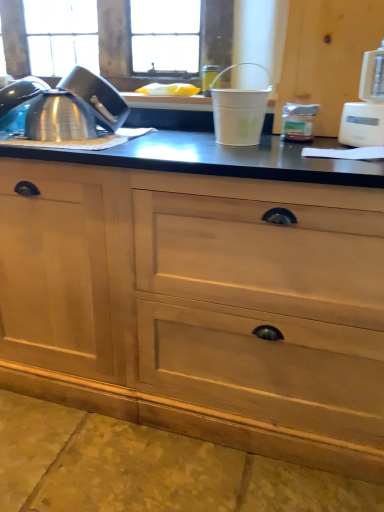
Question: Is white plastic blender at right, placed as the 2th appliance when sorted from left to right, positioned with its back to satin metallic teapot at left?

Choices:
 (A) no
 (B) yes

Answer: (A)

Question: Does white plastic blender at right, the 1th appliance from the right, have a greater height compared to satin metallic teapot at left?

Choices:
 (A) yes
 (B) no

Answer: (A)

Question: From the image's perspective, is white plastic blender at right, placed as the 2th appliance when sorted from left to right, below satin metallic teapot at left?

Choices:
 (A) no
 (B) yes

Answer: (A)

Question: From a real-world perspective, is white plastic blender at right, placed as the 2th appliance when sorted from left to right, on satin metallic teapot at left?

Choices:
 (A) no
 (B) yes

Answer: (B)

Question: From a real-world perspective, is white plastic blender at right, placed as the 2th appliance when sorted from left to right, under satin metallic teapot at left?

Choices:
 (A) no
 (B) yes

Answer: (A)

Question: From the image's perspective, is wooden cabinet at right, the 2th cabinetry in the left-to-right sequence, above or below white plastic bucket at center, the 1th appliance when ordered from left to right?

Choices:
 (A) below
 (B) above

Answer: (B)

Question: Considering their positions, is wooden cabinet at right, the 2th cabinetry in the left-to-right sequence, located in front of or behind white plastic bucket at center, the 1th appliance when ordered from left to right?

Choices:
 (A) front
 (B) behind

Answer: (B)

Question: In terms of height, does wooden cabinet at right, the 2th cabinetry in the left-to-right sequence, look taller or shorter compared to white plastic bucket at center, which is the 2th appliance from right to left?

Choices:
 (A) short
 (B) tall

Answer: (B)

Question: From a real-world perspective, is wooden cabinet at right, positioned as the first cabinetry in right-to-left order, physically located above or below white plastic bucket at center, the 1th appliance when ordered from left to right?

Choices:
 (A) below
 (B) above

Answer: (B)

Question: Looking at the image, does white plastic blender at right, the 1th appliance from the right, seem bigger or smaller compared to satin metallic teapot at left?

Choices:
 (A) big
 (B) small

Answer: (A)

Question: From the image's perspective, is white plastic blender at right, placed as the 2th appliance when sorted from left to right, positioned above or below satin metallic teapot at left?

Choices:
 (A) below
 (B) above

Answer: (B)

Question: Is point (367, 130) closer or farther from the camera than point (125, 109)?

Choices:
 (A) farther
 (B) closer

Answer: (B)

Question: Is white plastic blender at right, placed as the 2th appliance when sorted from left to right, taller or shorter than satin metallic teapot at left?

Choices:
 (A) tall
 (B) short

Answer: (A)

Question: In terms of height, does satin metallic teapot at left look taller or shorter compared to white plastic bucket at center, which is the 2th appliance from right to left?

Choices:
 (A) tall
 (B) short

Answer: (B)

Question: From a real-world perspective, is satin metallic teapot at left positioned above or below white plastic bucket at center, which is the 2th appliance from right to left?

Choices:
 (A) below
 (B) above

Answer: (A)